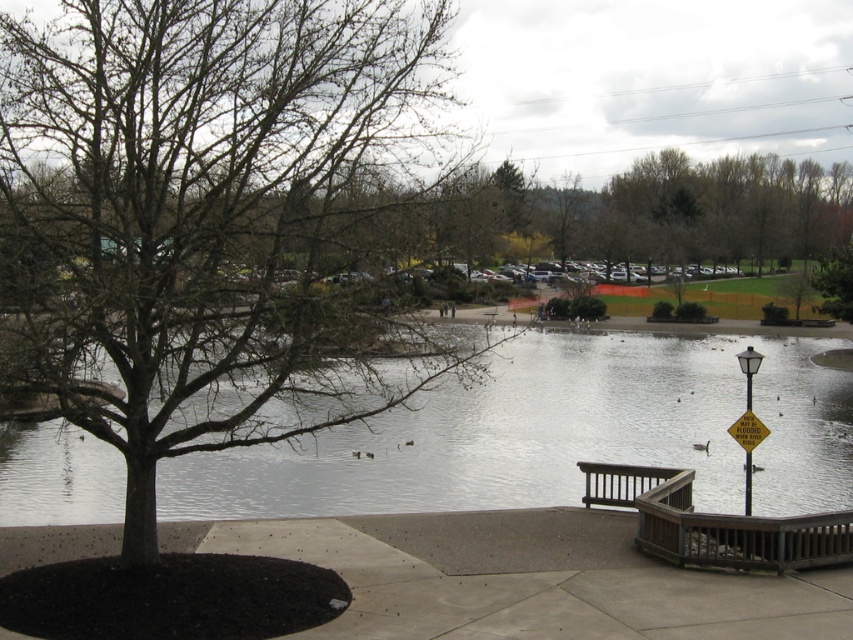
Question: Can you confirm if brown bark tree at left is positioned below yellow paper street sign at lower right?

Choices:
 (A) yes
 (B) no

Answer: (B)

Question: Which object appears closest to the camera in this image?

Choices:
 (A) clear water at center
 (B) yellow paper street sign at right
 (C) brown wooden bench at lower right

Answer: (A)

Question: Which object is positioned closest to the brown bark tree at left?

Choices:
 (A) yellow paper street sign at lower right
 (B) clear water at center
 (C) yellow paper street sign at right
 (D) brown wooden bench at lower right

Answer: (A)

Question: From the image, what is the correct spatial relationship of brown bark tree at left in relation to concrete at lower center?

Choices:
 (A) below
 (B) above

Answer: (B)

Question: Does brown bark tree at left have a lesser width compared to yellow paper street sign at lower right?

Choices:
 (A) no
 (B) yes

Answer: (A)

Question: Which object is the farthest from the brown bark tree at left?

Choices:
 (A) brown wooden bench at lower right
 (B) yellow paper street sign at lower right
 (C) yellow paper street sign at right

Answer: (C)